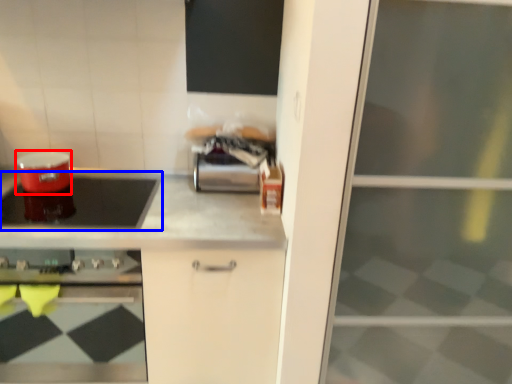
Question: Which point is further to the camera, appliance (highlighted by a red box) or kitchen appliance (highlighted by a blue box)?

Choices:
 (A) appliance
 (B) kitchen appliance

Answer: (A)